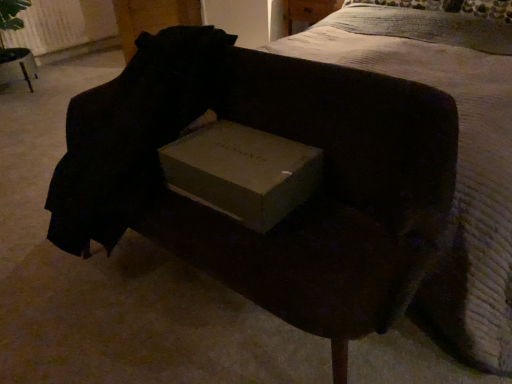
Question: Is white textured bed at upper center smaller than matte cardboard box at center?

Choices:
 (A) no
 (B) yes

Answer: (A)

Question: Is white textured bed at upper center further to camera compared to matte cardboard box at center?

Choices:
 (A) yes
 (B) no

Answer: (B)

Question: Would you say white textured bed at upper center is a long distance from matte cardboard box at center?

Choices:
 (A) no
 (B) yes

Answer: (A)

Question: Does white textured bed at upper center have a lesser width compared to matte cardboard box at center?

Choices:
 (A) no
 (B) yes

Answer: (A)

Question: Considering the relative sizes of white textured bed at upper center and matte cardboard box at center in the image provided, is white textured bed at upper center taller than matte cardboard box at center?

Choices:
 (A) no
 (B) yes

Answer: (B)

Question: From a real-world perspective, is matte cardboard box at center positioned above or below matte cardboard box at center?

Choices:
 (A) below
 (B) above

Answer: (A)

Question: From their relative heights in the image, would you say matte cardboard box at center is taller or shorter than matte cardboard box at center?

Choices:
 (A) tall
 (B) short

Answer: (A)

Question: Considering their positions, is matte cardboard box at center located in front of or behind matte cardboard box at center?

Choices:
 (A) front
 (B) behind

Answer: (A)

Question: From the image's perspective, relative to matte cardboard box at center, is matte cardboard box at center above or below?

Choices:
 (A) below
 (B) above

Answer: (B)

Question: Considering the positions of matte cardboard box at center and matte cardboard box at center in the image, is matte cardboard box at center wider or thinner than matte cardboard box at center?

Choices:
 (A) wide
 (B) thin

Answer: (B)

Question: Considering their positions, is matte cardboard box at center located in front of or behind matte cardboard box at center?

Choices:
 (A) front
 (B) behind

Answer: (B)

Question: From the image's perspective, is matte cardboard box at center positioned above or below matte cardboard box at center?

Choices:
 (A) below
 (B) above

Answer: (A)

Question: Considering the relative positions of matte cardboard box at center and matte cardboard box at center in the image provided, is matte cardboard box at center to the left or to the right of matte cardboard box at center?

Choices:
 (A) left
 (B) right

Answer: (B)

Question: Considering the positions of white textured bed at upper center and matte cardboard box at center in the image, is white textured bed at upper center wider or thinner than matte cardboard box at center?

Choices:
 (A) wide
 (B) thin

Answer: (A)

Question: Is white textured bed at upper center bigger or smaller than matte cardboard box at center?

Choices:
 (A) big
 (B) small

Answer: (A)